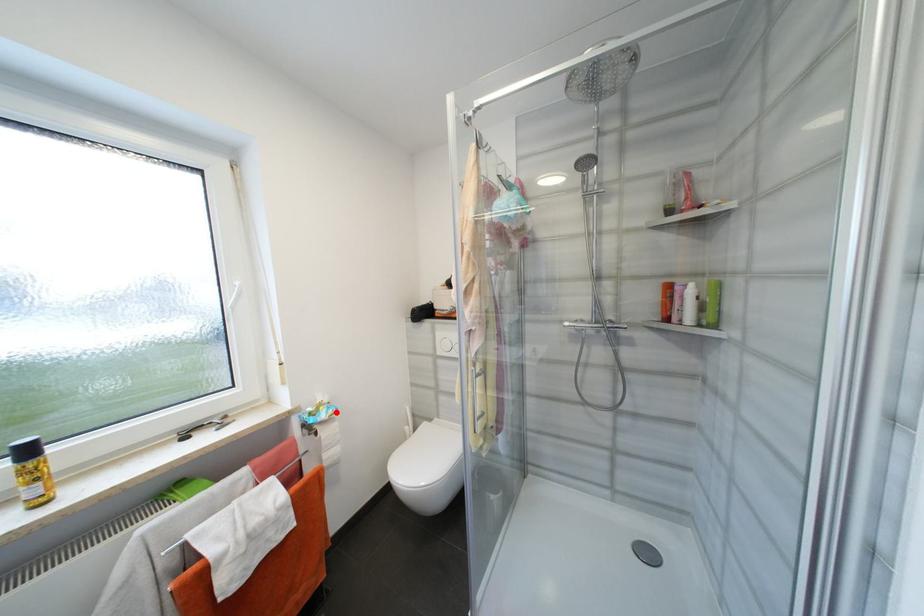
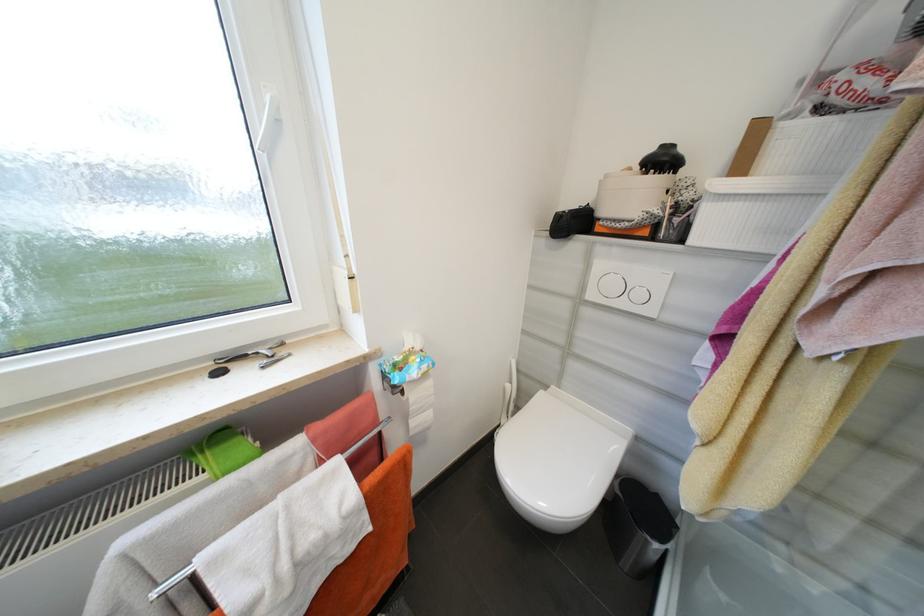
Where in the second image is the point corresponding to the highlighted location from the first image?

(430, 368)